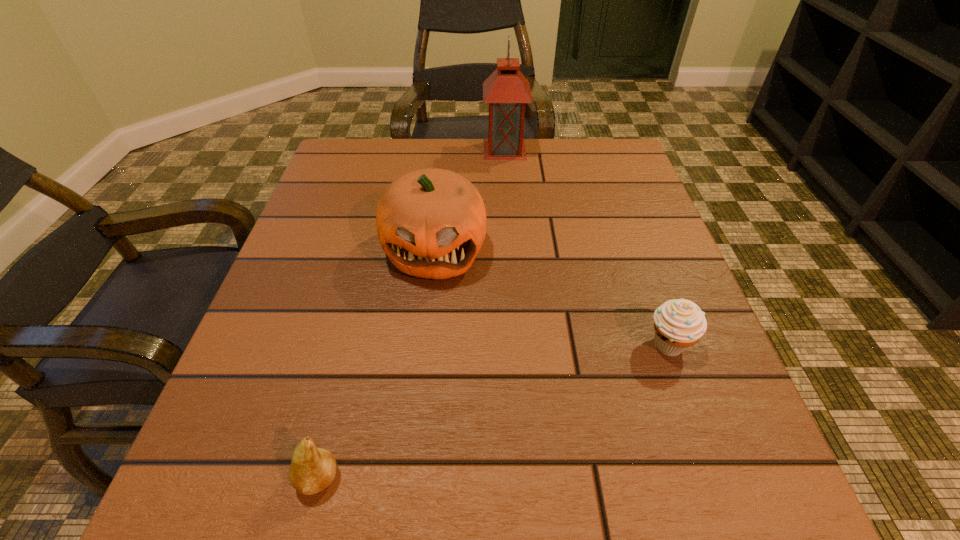
The height and width of the screenshot is (540, 960). I want to click on object identified as the third closest to the tallest object, so click(x=312, y=469).

This screenshot has height=540, width=960. I want to click on object that ranks as the second closest to the nearest object, so click(678, 323).

This screenshot has height=540, width=960. I want to click on free space that satisfies the following two spatial constraints: 1. on the face of the third nearest object; 2. on the left side of the rightmost object, so click(x=425, y=345).

The image size is (960, 540). In order to click on free space that satisfies the following two spatial constraints: 1. on the face of the third shortest object; 2. on the right side of the muffin in this screenshot , I will do `click(425, 345)`.

What are the coordinates of `blank area in the image that satisfies the following two spatial constraints: 1. on the face of the second tallest object; 2. on the left side of the rightmost object` in the screenshot? It's located at (425, 345).

At what (x,y) coordinates should I click in order to perform the action: click on free region that satisfies the following two spatial constraints: 1. on the face of the third nearest object; 2. on the left side of the rightmost object. Please return your answer as a coordinate pair (x, y). Looking at the image, I should click on (425, 345).